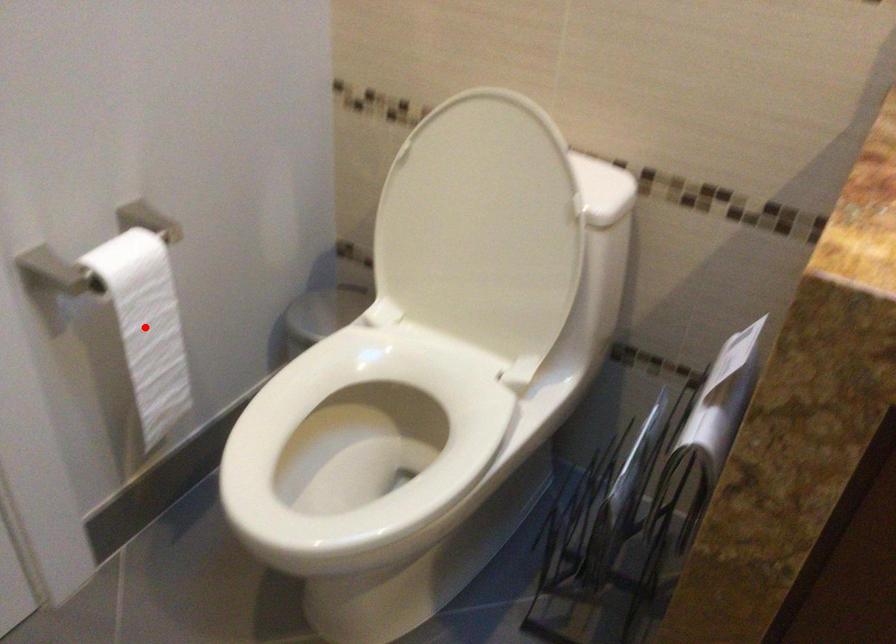
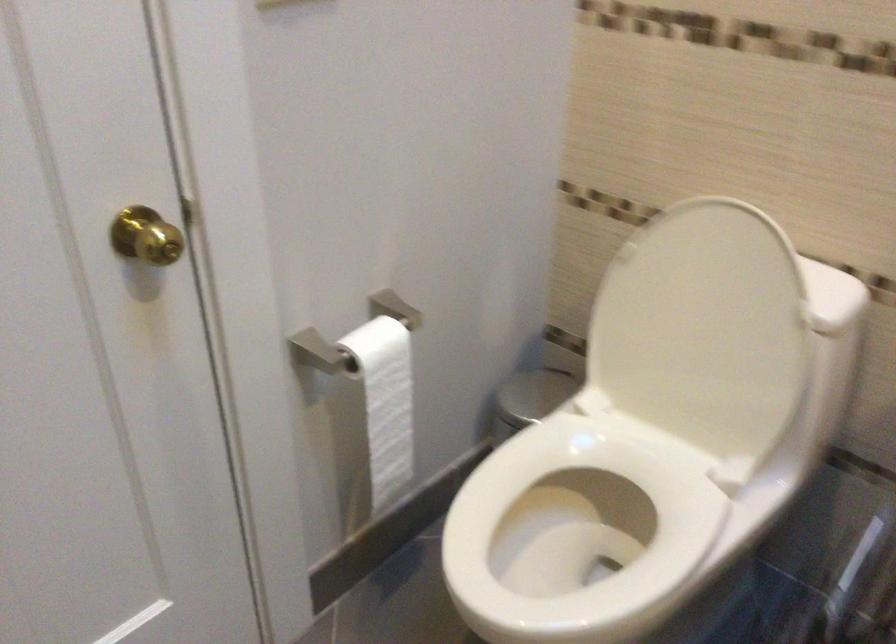
Question: I am providing you with two images of the same scene from different viewpoints. A red point is shown in image1. For the corresponding object point in image2, is it positioned nearer or farther from the camera?

Choices:
 (A) Nearer
 (B) Farther

Answer: (B)